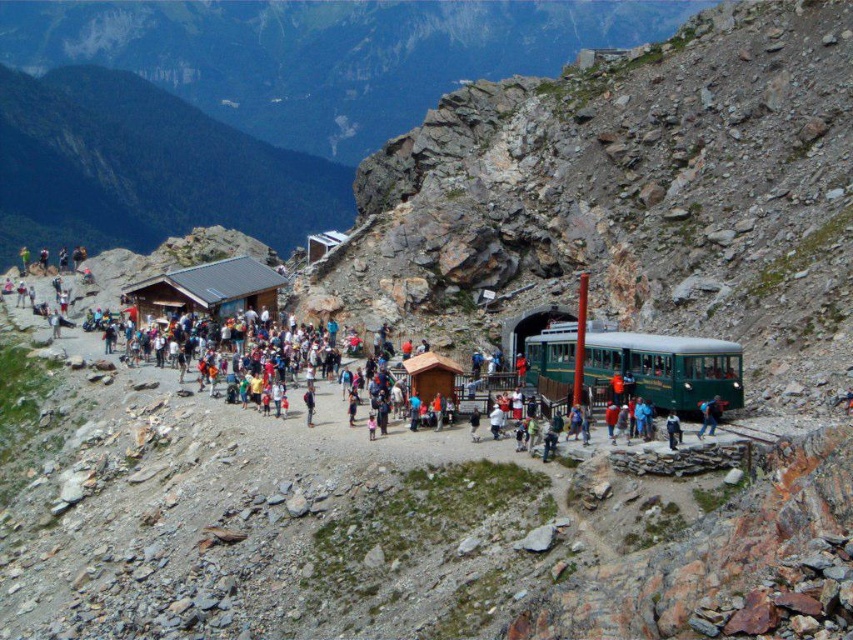
Question: Is green polished wood passenger train at center-right wider than green fabric jacket at lower right?

Choices:
 (A) no
 (B) yes

Answer: (B)

Question: Which point is closer to the camera?

Choices:
 (A) (704, 401)
 (B) (699, 400)
 (C) (306, 416)

Answer: (A)

Question: Does green polished wood passenger train at center-right have a larger size compared to light blue denim jeans at center?

Choices:
 (A) no
 (B) yes

Answer: (B)

Question: Considering the real-world distances, which object is closest to the green fabric jacket at lower right?

Choices:
 (A) light blue denim jeans at center
 (B) green polished wood passenger train at center-right

Answer: (B)

Question: Among these objects, which one is nearest to the camera?

Choices:
 (A) green fabric jacket at lower right
 (B) green polished wood passenger train at center-right
 (C) light blue denim jeans at center

Answer: (A)

Question: From the image, what is the correct spatial relationship of green fabric jacket at lower right in relation to light blue denim jeans at center?

Choices:
 (A) above
 (B) below

Answer: (B)